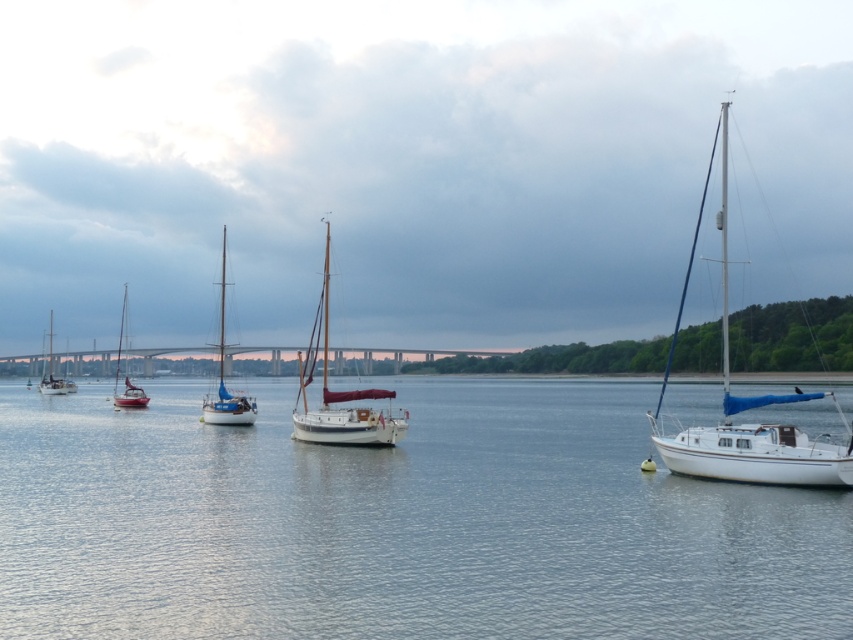
Which is more to the right, smooth water at center or white matte sailboat at right?

Positioned to the right is white matte sailboat at right.

Does smooth water at center come behind white matte sailboat at right?

That is False.

Between point (111, 600) and point (770, 472), which one is positioned behind?

The point (770, 472) is more distant.

You are a GUI agent. You are given a task and a screenshot of the screen. Output one action in this format:
    pyautogui.click(x=<x>, y=<y>)
    Task: Click on the smooth water at center
    Image resolution: width=853 pixels, height=640 pixels.
    Given the screenshot: What is the action you would take?
    [398, 524]

Is matte white sailboat at left to the right of white sailboat at left from the viewer's perspective?

Indeed, matte white sailboat at left is positioned on the right side of white sailboat at left.

From the picture: Between matte white sailboat at left and white sailboat at left, which one appears on the left side from the viewer's perspective?

Positioned to the left is white sailboat at left.

You are a GUI agent. You are given a task and a screenshot of the screen. Output one action in this format:
    pyautogui.click(x=<x>, y=<y>)
    Task: Click on the matte white sailboat at left
    This screenshot has height=640, width=853.
    Given the screenshot: What is the action you would take?
    126,372

I want to click on wooden sailboat at center, so click(223, 376).

Between wooden sailboat at center and matte white sailboat at left, which one is positioned lower?

matte white sailboat at left is below.

Which is behind, point (206, 396) or point (126, 406)?

Point (126, 406)

Where is `wooden sailboat at center`? The image size is (853, 640). wooden sailboat at center is located at coordinates (223, 376).